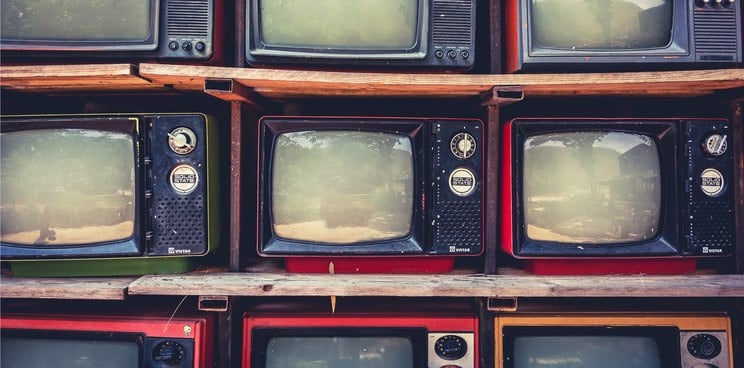
Locate an element on the screen. Image resolution: width=744 pixels, height=368 pixels. television screens is located at coordinates tap(80, 21), tap(356, 16), tap(577, 26), tap(574, 184), tap(583, 350), tap(343, 351), tap(343, 191), tap(45, 188), tap(51, 351).